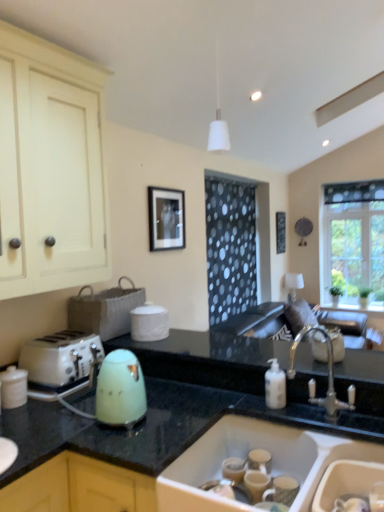
Question: From the image's perspective, is white glossy jar at lower left located above or below green glossy kettle at lower center?

Choices:
 (A) below
 (B) above

Answer: (B)

Question: Is white glossy jar at lower left in front of or behind green glossy kettle at lower center in the image?

Choices:
 (A) front
 (B) behind

Answer: (B)

Question: Which of these objects is positioned farthest from the white ceramic sink at lower center?

Choices:
 (A) green glossy kettle at lower center
 (B) matte cream cabinet at left
 (C) clear glass window at upper right
 (D) white glossy jar at lower left
 (E) black matte picture frame at upper center

Answer: (C)

Question: Which is farther from the clear glass window at upper right?

Choices:
 (A) white glossy jar at lower left
 (B) white plastic toaster at left
 (C) matte cream cabinet at left
 (D) green glossy kettle at lower center
 (E) black matte picture frame at upper center

Answer: (A)